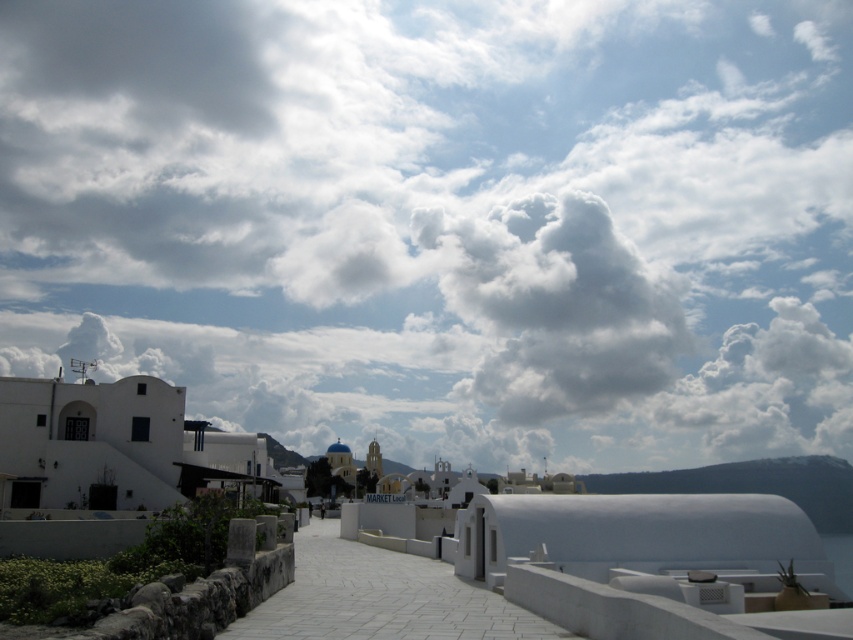
Question: From the image, what is the correct spatial relationship of white fluffy cloud at upper center in relation to white stone path at center?

Choices:
 (A) right
 (B) left

Answer: (B)

Question: Is white fluffy cloud at upper center thinner than white stone path at center?

Choices:
 (A) no
 (B) yes

Answer: (A)

Question: Can you confirm if white fluffy cloud at upper center is wider than white stone path at center?

Choices:
 (A) yes
 (B) no

Answer: (A)

Question: Which object appears closest to the camera in this image?

Choices:
 (A) white stone path at center
 (B) white fluffy cloud at upper center

Answer: (A)

Question: Which object is farther from the camera taking this photo?

Choices:
 (A) white fluffy cloud at upper center
 (B) white stone path at center

Answer: (A)